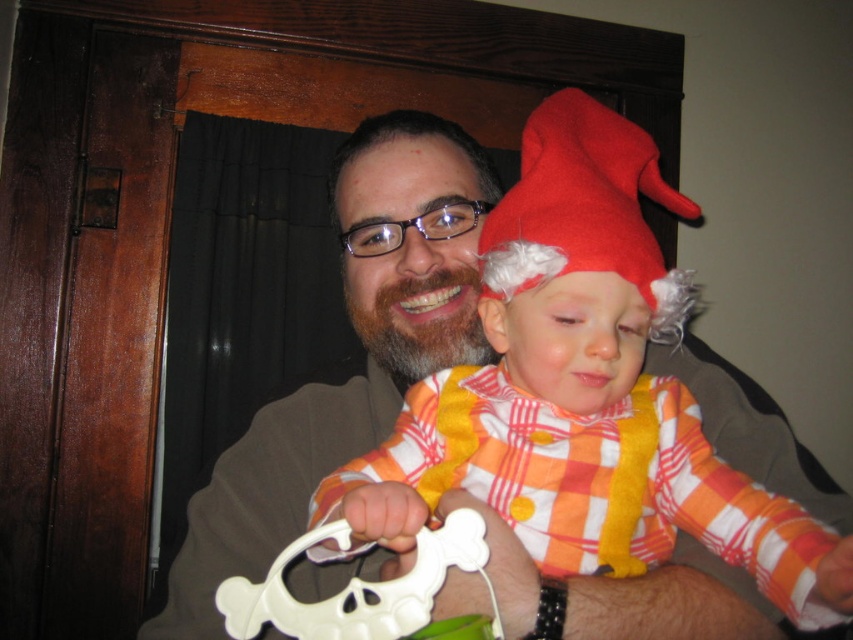
Can you confirm if matte brown suit at center is smaller than red felt gnome hat at upper center?

Actually, matte brown suit at center might be larger than red felt gnome hat at upper center.

Who is more distant from viewer, (387, 202) or (576, 240)?

The point (387, 202) is more distant.

This screenshot has width=853, height=640. Identify the location of matte brown suit at center. (364, 348).

Who is positioned more to the right, matte brown suit at center or white plastic skull at center?

matte brown suit at center

Can you confirm if matte brown suit at center is thinner than white plastic skull at center?

In fact, matte brown suit at center might be wider than white plastic skull at center.

Is point (495, 548) closer to camera compared to point (500, 628)?

No, (495, 548) is behind (500, 628).

Where is `matte brown suit at center`? matte brown suit at center is located at coordinates (364, 348).

What do you see at coordinates (585, 211) in the screenshot? I see `red felt gnome hat at upper center` at bounding box center [585, 211].

Can you confirm if red felt gnome hat at upper center is taller than white plastic skull at center?

Yes.

What do you see at coordinates (585, 211) in the screenshot?
I see `red felt gnome hat at upper center` at bounding box center [585, 211].

Locate an element on the screen. The width and height of the screenshot is (853, 640). red felt gnome hat at upper center is located at coordinates (585, 211).